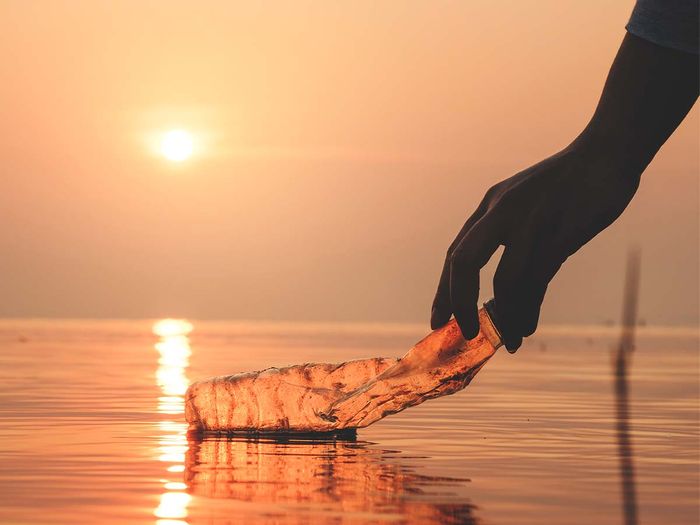
This screenshot has height=525, width=700. What are the coordinates of `trash` in the screenshot? It's located at (315, 406).